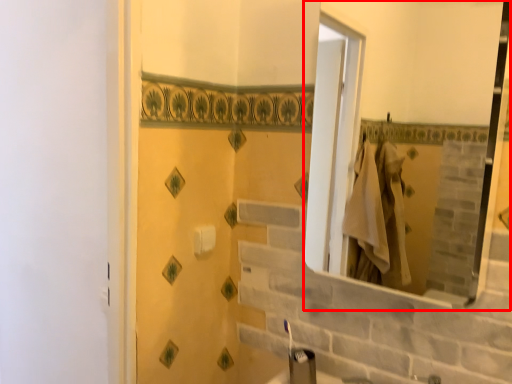
Question: Where is mirror (annotated by the red box) located in relation to toilet paper in the image?

Choices:
 (A) left
 (B) right

Answer: (B)